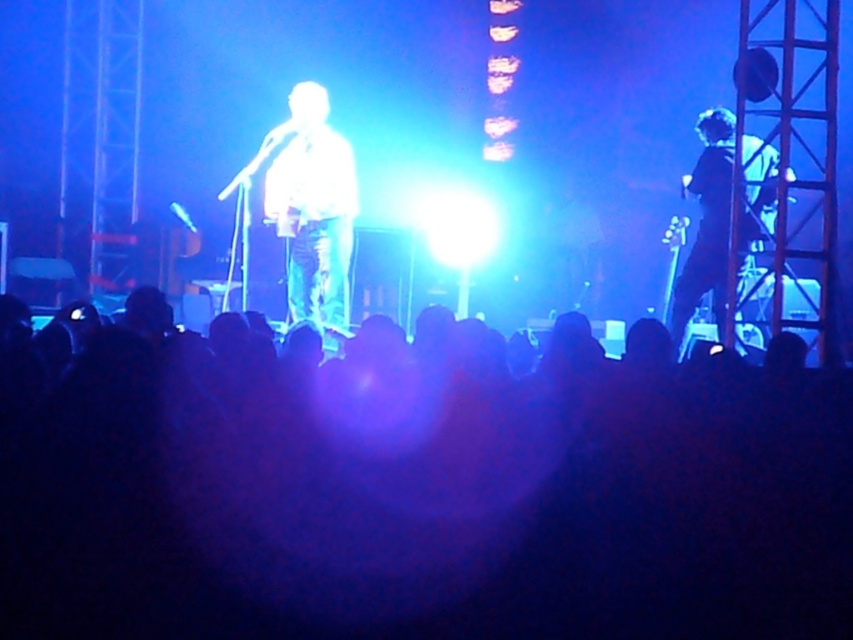
Can you confirm if black matte crowd at center is bigger than white glossy shirt at center?

Yes.

Who is more forward, [538,609] or [339,228]?

Positioned in front is point [538,609].

Does point (10, 611) come farther from viewer compared to point (265, 188)?

No.

This screenshot has height=640, width=853. Find the location of `black matte crowd at center`. black matte crowd at center is located at coordinates (419, 500).

Does point (309, 280) come in front of point (770, 152)?

No.

Which is behind, point (341, 177) or point (671, 333)?

The point (341, 177) is behind.

Is point (305, 109) positioned in front of point (730, 116)?

No, (305, 109) is behind (730, 116).

This screenshot has width=853, height=640. What are the coordinates of `white glossy shirt at center` in the screenshot? It's located at (312, 209).

Is point (621, 548) closer to viewer compared to point (705, 221)?

Yes, it is in front of point (705, 221).

Which is below, black matte crowd at center or dark blue jeans at right?

black matte crowd at center

Between point (228, 602) and point (747, 228), which one is positioned behind?

Positioned behind is point (747, 228).

Where is `black matte crowd at center`? black matte crowd at center is located at coordinates (419, 500).